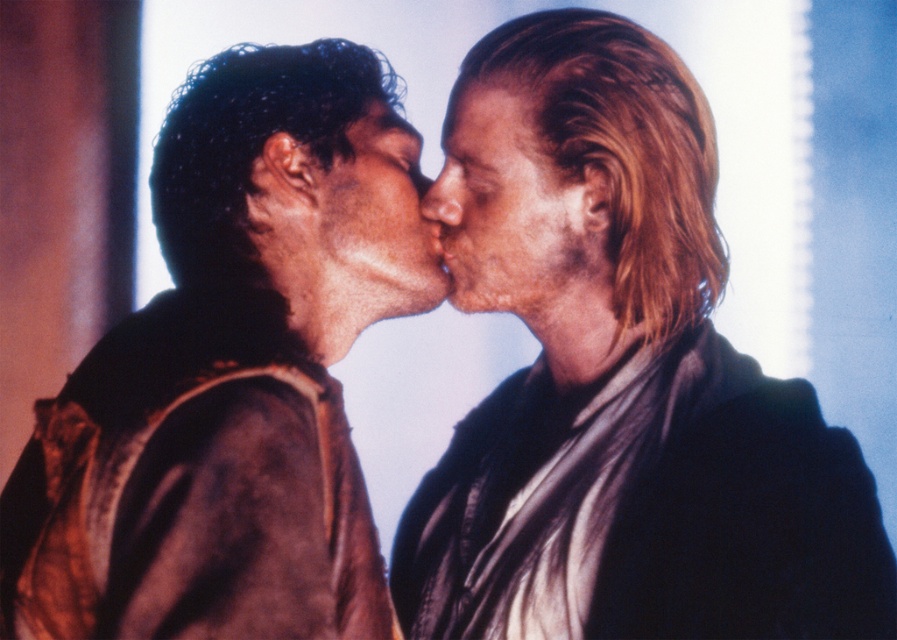
Is shiny black jacket at right bigger than brown suede jacket at left?

Indeed, shiny black jacket at right has a larger size compared to brown suede jacket at left.

Is shiny black jacket at right to the right of brown suede jacket at left from the viewer's perspective?

Yes, shiny black jacket at right is to the right of brown suede jacket at left.

This screenshot has width=897, height=640. Describe the element at coordinates (625, 388) in the screenshot. I see `shiny black jacket at right` at that location.

Image resolution: width=897 pixels, height=640 pixels. Identify the location of shiny black jacket at right. (625, 388).

Is brown suede jacket at left smaller than smooth skin face at center?

No, brown suede jacket at left is not smaller than smooth skin face at center.

Which is in front, point (96, 522) or point (556, 260)?

Point (96, 522) is more forward.

Describe the element at coordinates (232, 374) in the screenshot. Image resolution: width=897 pixels, height=640 pixels. I see `brown suede jacket at left` at that location.

Image resolution: width=897 pixels, height=640 pixels. In order to click on brown suede jacket at left in this screenshot , I will do `click(232, 374)`.

Between point (464, 186) and point (486, 106), which one is positioned behind?

The point (464, 186) is behind.

Find the location of `smooth skin face at center`. smooth skin face at center is located at coordinates (514, 214).